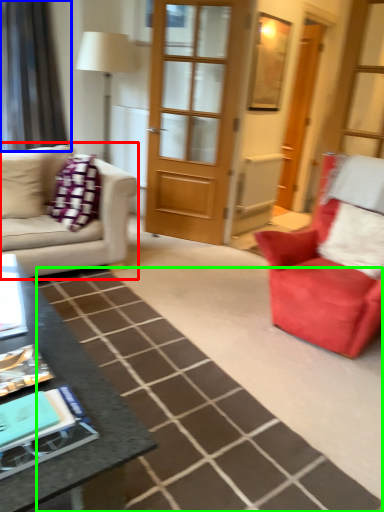
Question: Which object is the farthest from studio couch (highlighted by a red box)? Choose among these: curtain (highlighted by a blue box) or plain (highlighted by a green box).

Choices:
 (A) curtain
 (B) plain

Answer: (A)